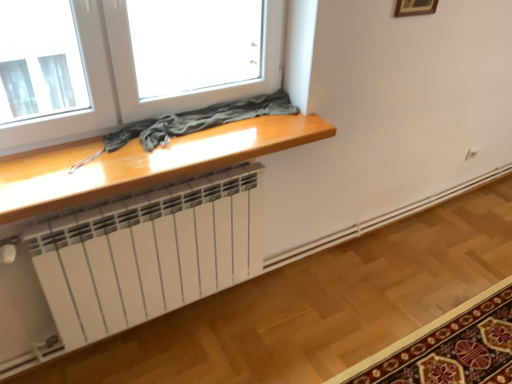
Where is `carpet with floral pattern at lower right`? carpet with floral pattern at lower right is located at coordinates (449, 347).

Which of these two, wooden picture frame at upper right or glossy wood table at upper center, stands shorter?

glossy wood table at upper center.

Which object is positioned more to the right, wooden picture frame at upper right or glossy wood table at upper center?

Positioned to the right is wooden picture frame at upper right.

Is point (412, 1) positioned after point (13, 167)?

Yes, it is.

Which of these two, wooden picture frame at upper right or carpet with floral pattern at lower right, is smaller?

wooden picture frame at upper right is smaller.

Which is in front, wooden picture frame at upper right or carpet with floral pattern at lower right?

carpet with floral pattern at lower right is in front.

Considering the relative positions of wooden picture frame at upper right and carpet with floral pattern at lower right in the image provided, is wooden picture frame at upper right to the right of carpet with floral pattern at lower right from the viewer's perspective?

In fact, wooden picture frame at upper right is to the left of carpet with floral pattern at lower right.

Could you tell me if wooden picture frame at upper right is turned towards carpet with floral pattern at lower right?

No, wooden picture frame at upper right is not aimed at carpet with floral pattern at lower right.

Is carpet with floral pattern at lower right not close to glossy wood table at upper center?

Yes, carpet with floral pattern at lower right and glossy wood table at upper center are quite far apart.

Does carpet with floral pattern at lower right have a greater width compared to glossy wood table at upper center?

Yes.

Considering the positions of points (460, 317) and (97, 148), is point (460, 317) farther from camera compared to point (97, 148)?

Yes.

From the image's perspective, which is above, carpet with floral pattern at lower right or glossy wood table at upper center?

glossy wood table at upper center is shown above in the image.

Is the position of glossy wood table at upper center less distant than that of wooden picture frame at upper right?

Yes, the depth of glossy wood table at upper center is less than that of wooden picture frame at upper right.

From a real-world perspective, relative to wooden picture frame at upper right, is glossy wood table at upper center vertically above or below?

In terms of real-world spatial position, glossy wood table at upper center is below wooden picture frame at upper right.

Is glossy wood table at upper center taller than wooden picture frame at upper right?

In fact, glossy wood table at upper center may be shorter than wooden picture frame at upper right.

Between carpet with floral pattern at lower right and wooden picture frame at upper right, which one has larger width?

Wider between the two is carpet with floral pattern at lower right.

From the image's perspective, is carpet with floral pattern at lower right located above or below wooden picture frame at upper right?

Based on their image positions, carpet with floral pattern at lower right is located beneath wooden picture frame at upper right.

Which of these two, carpet with floral pattern at lower right or wooden picture frame at upper right, is bigger?

With larger size is carpet with floral pattern at lower right.

Are carpet with floral pattern at lower right and wooden picture frame at upper right far apart?

Absolutely, carpet with floral pattern at lower right is distant from wooden picture frame at upper right.

Between glossy wood table at upper center and carpet with floral pattern at lower right, which one has smaller size?

Smaller between the two is glossy wood table at upper center.

What's the angular difference between glossy wood table at upper center and carpet with floral pattern at lower right's facing directions?

glossy wood table at upper center and carpet with floral pattern at lower right are facing 89.6 degrees away from each other.

From a real-world perspective, is glossy wood table at upper center physically above carpet with floral pattern at lower right?

Yes.

The width and height of the screenshot is (512, 384). Identify the location of table in front of the wooden picture frame at upper right. (141, 163).

I want to click on mat that is under the wooden picture frame at upper right (from a real-world perspective), so click(449, 347).

Looking at the image, which one is located further to wooden picture frame at upper right, carpet with floral pattern at lower right or glossy wood table at upper center?

carpet with floral pattern at lower right is further to wooden picture frame at upper right.

From the image, which object appears to be farther from glossy wood table at upper center, carpet with floral pattern at lower right or wooden picture frame at upper right?

carpet with floral pattern at lower right is further to glossy wood table at upper center.

Estimate the real-world distances between objects in this image. Which object is further from wooden picture frame at upper right, glossy wood table at upper center or carpet with floral pattern at lower right?

The object further to wooden picture frame at upper right is carpet with floral pattern at lower right.

Estimate the real-world distances between objects in this image. Which object is closer to glossy wood table at upper center, wooden picture frame at upper right or carpet with floral pattern at lower right?

Among the two, wooden picture frame at upper right is located nearer to glossy wood table at upper center.

Looking at the image, which one is located further to carpet with floral pattern at lower right, wooden picture frame at upper right or glossy wood table at upper center?

wooden picture frame at upper right lies further to carpet with floral pattern at lower right than the other object.

Looking at the image, which one is located further to carpet with floral pattern at lower right, glossy wood table at upper center or wooden picture frame at upper right?

wooden picture frame at upper right lies further to carpet with floral pattern at lower right than the other object.

Find the location of a particular element. table between wooden picture frame at upper right and carpet with floral pattern at lower right in the vertical direction is located at coordinates (141, 163).